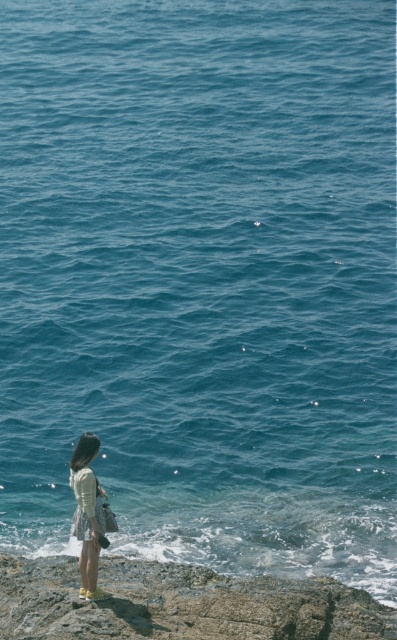
Is rough stone cliff at lower left above white cotton dress at lower left?

No, rough stone cliff at lower left is not above white cotton dress at lower left.

The image size is (397, 640). I want to click on rough stone cliff at lower left, so click(179, 604).

At what (x,y) coordinates should I click in order to perform the action: click on rough stone cliff at lower left. Please return your answer as a coordinate pair (x, y). This screenshot has height=640, width=397. Looking at the image, I should click on (179, 604).

From the picture: Does light yellow fabric skirt at lower left lie in front of white cotton dress at lower left?

Yes, light yellow fabric skirt at lower left is in front of white cotton dress at lower left.

At what (x,y) coordinates should I click in order to perform the action: click on light yellow fabric skirt at lower left. Please return your answer as a coordinate pair (x, y). Looking at the image, I should click on (86, 513).

Where is `light yellow fabric skirt at lower left`? light yellow fabric skirt at lower left is located at coordinates (86, 513).

Between point (281, 637) and point (71, 458), which one is positioned behind?

The point (71, 458) is more distant.

Can you confirm if rough stone cliff at lower left is thinner than light yellow fabric skirt at lower left?

Yes, rough stone cliff at lower left is thinner than light yellow fabric skirt at lower left.

At what (x,y) coordinates should I click in order to perform the action: click on rough stone cliff at lower left. Please return your answer as a coordinate pair (x, y). Image resolution: width=397 pixels, height=640 pixels. Looking at the image, I should click on (179, 604).

At what (x,y) coordinates should I click in order to perform the action: click on rough stone cliff at lower left. Please return your answer as a coordinate pair (x, y). This screenshot has width=397, height=640. Looking at the image, I should click on (179, 604).